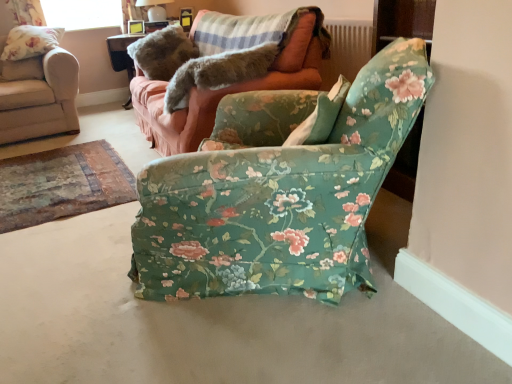
Find the location of a particular element. The height and width of the screenshot is (384, 512). matte white lampshade at upper center is located at coordinates (154, 9).

The width and height of the screenshot is (512, 384). Describe the element at coordinates (223, 83) in the screenshot. I see `floral fabric couch at center` at that location.

This screenshot has height=384, width=512. Describe the element at coordinates (277, 191) in the screenshot. I see `floral fabric chair at center, acting as the first chair starting from the right` at that location.

Image resolution: width=512 pixels, height=384 pixels. What do you see at coordinates (31, 41) in the screenshot?
I see `floral fabric pillow at upper left` at bounding box center [31, 41].

Where is `matte white lampshade at upper center`? The width and height of the screenshot is (512, 384). matte white lampshade at upper center is located at coordinates (154, 9).

From a real-world perspective, which is physically below, floral fabric chair at center, the 1th chair viewed from the front, or matte wooden picture frame at upper center?

floral fabric chair at center, the 1th chair viewed from the front, from a real-world perspective.

In the scene shown: Which of these two, floral fabric chair at center, the 2th chair when ordered from left to right, or matte wooden picture frame at upper center, stands shorter?

matte wooden picture frame at upper center is shorter.

Measure the distance from floral fabric chair at center, the 2th chair when ordered from left to right, to matte wooden picture frame at upper center.

The distance of floral fabric chair at center, the 2th chair when ordered from left to right, from matte wooden picture frame at upper center is 3.48 meters.

From the picture: Considering the relative positions of floral fabric chair at center, marked as the 2th chair in a back-to-front arrangement, and matte wooden picture frame at upper center in the image provided, is floral fabric chair at center, marked as the 2th chair in a back-to-front arrangement, to the left or to the right of matte wooden picture frame at upper center?

Clearly, floral fabric chair at center, marked as the 2th chair in a back-to-front arrangement, is on the right of matte wooden picture frame at upper center in the image.

Does matte wooden picture frame at upper center have a larger size compared to floral fabric chair at center, the 2th chair when ordered from left to right?

Incorrect, matte wooden picture frame at upper center is not larger than floral fabric chair at center, the 2th chair when ordered from left to right.

Consider the image. From the image's perspective, is matte wooden picture frame at upper center located beneath floral fabric chair at center, the 1th chair viewed from the front?

No.

From the picture: Can floral fabric chair at center, marked as the 2th chair in a back-to-front arrangement, be found inside matte wooden picture frame at upper center?

That's incorrect, floral fabric chair at center, marked as the 2th chair in a back-to-front arrangement, is not inside matte wooden picture frame at upper center.

From the image's perspective, is matte white lampshade at upper center above floral fabric chair at center, the 1th chair viewed from the front?

Correct, matte white lampshade at upper center appears higher than floral fabric chair at center, the 1th chair viewed from the front, in the image.

How different are the orientations of matte white lampshade at upper center and floral fabric chair at center, acting as the first chair starting from the right, in degrees?

The facing directions of matte white lampshade at upper center and floral fabric chair at center, acting as the first chair starting from the right, are 96.6 degrees apart.

Is matte white lampshade at upper center wider than floral fabric chair at center, the 1th chair viewed from the front?

No.

Is the position of matte white lampshade at upper center less distant than that of floral fabric chair at center, marked as the 2th chair in a back-to-front arrangement?

That is False.

Is beige fabric chair at upper left, marked as the second chair in a front-to-back arrangement, with furry gray cat at upper center?

No, beige fabric chair at upper left, marked as the second chair in a front-to-back arrangement, is not making contact with furry gray cat at upper center.

From a real-world perspective, is beige fabric chair at upper left, arranged as the second chair when viewed from the right, positioned above or below furry gray cat at upper center?

beige fabric chair at upper left, arranged as the second chair when viewed from the right, is below furry gray cat at upper center.

Find the location of `chair on the left of furry gray cat at upper center`. chair on the left of furry gray cat at upper center is located at coordinates (40, 98).

From the image's perspective, between beige fabric chair at upper left, the 1th chair in the back-to-front sequence, and furry gray cat at upper center, who is located below?

furry gray cat at upper center, from the image's perspective.

From the picture: Is floral fabric pillow at upper left inside the boundaries of matte wooden picture frame at upper center, or outside?

floral fabric pillow at upper left exists outside the volume of matte wooden picture frame at upper center.

Consider the image. Which object is positioned more to the left, floral fabric pillow at upper left or matte wooden picture frame at upper center?

From the viewer's perspective, floral fabric pillow at upper left appears more on the left side.

Measure the distance from floral fabric pillow at upper left to matte wooden picture frame at upper center.

3.31 feet.

How different are the orientations of floral fabric pillow at upper left and matte wooden picture frame at upper center in degrees?

The angle between the facing direction of floral fabric pillow at upper left and the facing direction of matte wooden picture frame at upper center is 23.6 degrees.

From the image's perspective, relative to floral fabric pillow at upper left, is matte white lampshade at upper center above or below?

Based on their image positions, matte white lampshade at upper center is located above floral fabric pillow at upper left.

Is matte white lampshade at upper center taller than floral fabric pillow at upper left?

Incorrect, the height of matte white lampshade at upper center is not larger of that of floral fabric pillow at upper left.

Is matte white lampshade at upper center wider or thinner than floral fabric pillow at upper left?

In the image, matte white lampshade at upper center appears to be more narrow than floral fabric pillow at upper left.

Is matte white lampshade at upper center smaller than floral fabric pillow at upper left?

Yes, matte white lampshade at upper center is smaller than floral fabric pillow at upper left.

Is matte white lampshade at upper center oriented away from furry gray cat at upper center?

matte white lampshade at upper center does not have its back to furry gray cat at upper center.

Is matte white lampshade at upper center wider or thinner than furry gray cat at upper center?

Considering their sizes, matte white lampshade at upper center looks slimmer than furry gray cat at upper center.

Can you tell me how much matte white lampshade at upper center and furry gray cat at upper center differ in facing direction?

46.4 degrees separate the facing orientations of matte white lampshade at upper center and furry gray cat at upper center.

Is point (148, 1) less distant than point (227, 70)?

No.

Image resolution: width=512 pixels, height=384 pixels. What are the coordinates of `chair on the right side of matte wooden picture frame at upper center` in the screenshot? It's located at (277, 191).

Locate an element on the screen. This screenshot has height=384, width=512. picture frame above the floral fabric chair at center, marked as the 2th chair in a back-to-front arrangement (from the image's perspective) is located at coordinates (136, 27).

From the image, which object appears to be farther from floral fabric couch at center, floral fabric pillow at upper left or floral fabric chair at center, acting as the first chair starting from the right?

floral fabric pillow at upper left is further to floral fabric couch at center.

Estimate the real-world distances between objects in this image. Which object is closer to matte wooden picture frame at upper center, matte white lampshade at upper center or floral fabric pillow at upper left?

Based on the image, matte white lampshade at upper center appears to be nearer to matte wooden picture frame at upper center.

Based on the photo, from the image, which object appears to be farther from matte white lampshade at upper center, floral fabric couch at center or furry gray cat at upper center?

furry gray cat at upper center lies further to matte white lampshade at upper center than the other object.

Estimate the real-world distances between objects in this image. Which object is closer to floral fabric pillow at upper left, floral fabric couch at center or matte wooden picture frame at upper center?

The object closer to floral fabric pillow at upper left is matte wooden picture frame at upper center.

From the image, which object appears to be farther from floral fabric pillow at upper left, floral fabric couch at center or furry gray cat at upper center?

furry gray cat at upper center is positioned further to the anchor floral fabric pillow at upper left.

When comparing their distances from floral fabric couch at center, does beige fabric chair at upper left, arranged as the second chair when viewed from the right, or furry gray cat at upper center seem further?

beige fabric chair at upper left, arranged as the second chair when viewed from the right.

Estimate the real-world distances between objects in this image. Which object is further from beige fabric chair at upper left, the 1th chair in the back-to-front sequence, floral fabric pillow at upper left or floral fabric couch at center?

floral fabric couch at center.

Which object lies nearer to the anchor point furry gray cat at upper center, matte white lampshade at upper center or floral fabric chair at center, the 2th chair when ordered from left to right?

floral fabric chair at center, the 2th chair when ordered from left to right.

Locate an element on the screen. The height and width of the screenshot is (384, 512). lamp located between floral fabric chair at center, the 2th chair when ordered from left to right, and matte wooden picture frame at upper center in the depth direction is located at coordinates (154, 9).

What are the coordinates of `studio couch between beige fabric chair at upper left, arranged as the second chair when viewed from the right, and furry gray cat at upper center` in the screenshot? It's located at (223, 83).

Find the location of a particular element. This screenshot has width=512, height=384. studio couch positioned between floral fabric chair at center, acting as the first chair starting from the right, and floral fabric pillow at upper left from near to far is located at coordinates (223, 83).

At what (x,y) coordinates should I click in order to perform the action: click on lamp positioned between floral fabric couch at center and matte wooden picture frame at upper center from near to far. Please return your answer as a coordinate pair (x, y). Image resolution: width=512 pixels, height=384 pixels. Looking at the image, I should click on (154, 9).